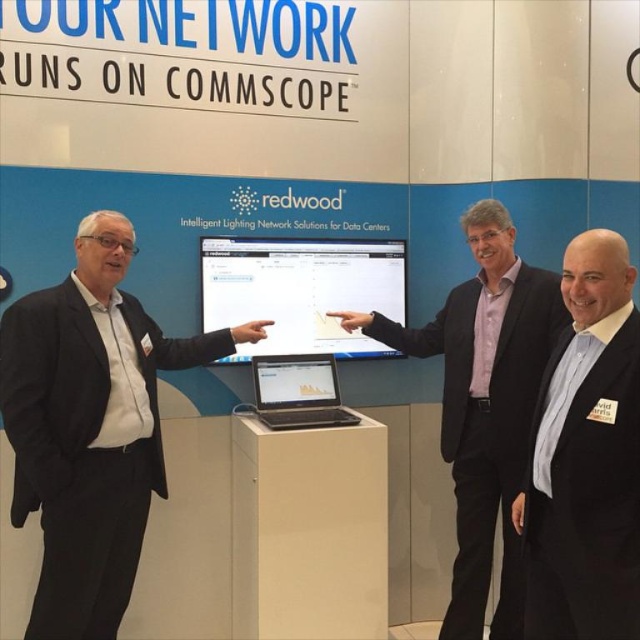
Question: Which of the following is the closest to the observer?

Choices:
 (A) black suit at left
 (B) black suit at center

Answer: (B)

Question: Which is nearer to the black suit at center?

Choices:
 (A) pink fabric shirt at center
 (B) black suit at left

Answer: (A)

Question: Is black suit at left smaller than black suit at center?

Choices:
 (A) no
 (B) yes

Answer: (A)

Question: Estimate the real-world distances between objects in this image. Which object is farther from the sleek silver laptop at center?

Choices:
 (A) black suit at left
 (B) pink fabric shirt at center

Answer: (A)

Question: Is pink fabric shirt at center below sleek silver laptop at center?

Choices:
 (A) yes
 (B) no

Answer: (A)

Question: Does black suit at center appear on the left side of sleek silver laptop at center?

Choices:
 (A) no
 (B) yes

Answer: (A)